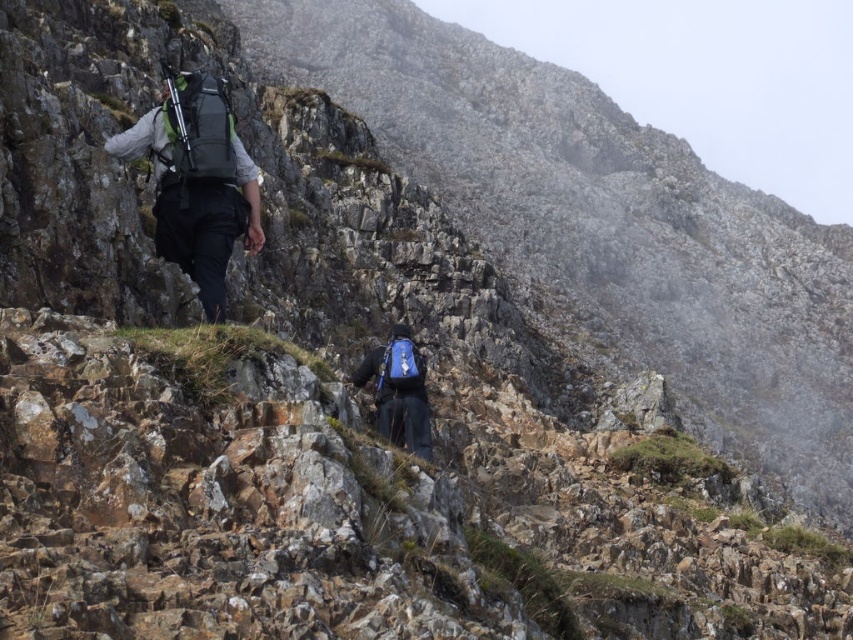
Question: Does matte black backpack at left appear on the right side of blue fabric backpack at center?

Choices:
 (A) yes
 (B) no

Answer: (B)

Question: Which point is farther to the camera?

Choices:
 (A) matte black backpack at left
 (B) blue fabric backpack at center

Answer: (B)

Question: Is matte black backpack at left bigger than blue fabric backpack at center?

Choices:
 (A) yes
 (B) no

Answer: (A)

Question: Which of the following is the closest to the observer?

Choices:
 (A) blue fabric backpack at center
 (B) matte black backpack at left

Answer: (B)

Question: Is matte black backpack at left above blue fabric backpack at center?

Choices:
 (A) yes
 (B) no

Answer: (A)

Question: Which of the following is the farthest from the observer?

Choices:
 (A) (405, 326)
 (B) (155, 221)

Answer: (A)